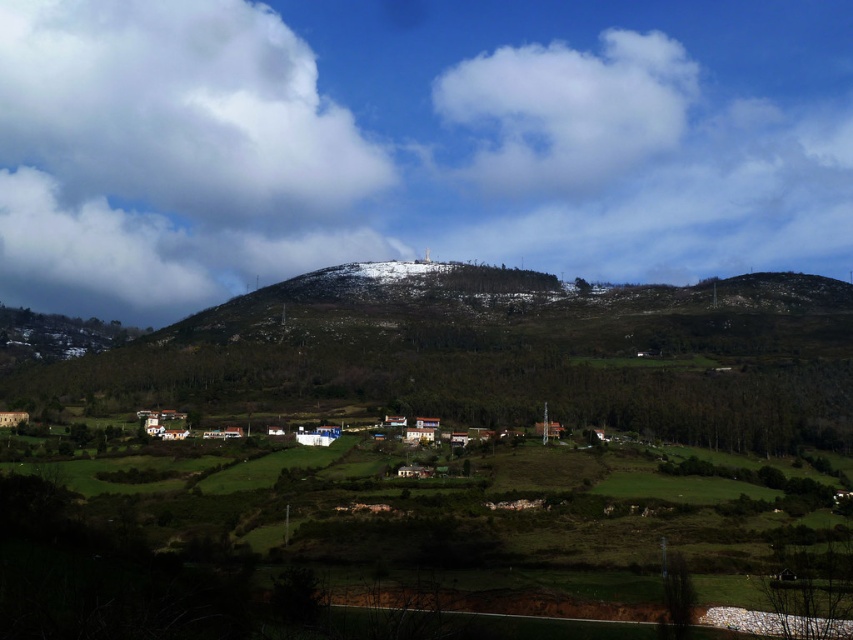
Is white fluffy cloud at upper left to the left of white fluffy cloud at upper center from the viewer's perspective?

Yes, white fluffy cloud at upper left is to the left of white fluffy cloud at upper center.

Describe the element at coordinates (178, 112) in the screenshot. Image resolution: width=853 pixels, height=640 pixels. I see `white fluffy cloud at upper left` at that location.

This screenshot has height=640, width=853. I want to click on white fluffy cloud at upper left, so click(178, 112).

This screenshot has width=853, height=640. In order to click on white fluffy cloud at upper center in this screenshot , I will do `click(567, 109)`.

Is white fluffy cloud at upper center taller than cloudy white cloud at upper left?

Correct, white fluffy cloud at upper center is much taller as cloudy white cloud at upper left.

Image resolution: width=853 pixels, height=640 pixels. What do you see at coordinates (567, 109) in the screenshot? I see `white fluffy cloud at upper center` at bounding box center [567, 109].

Find the location of a particular element. The image size is (853, 640). white fluffy cloud at upper center is located at coordinates (567, 109).

Between white fluffy cloud at upper left and cloudy white cloud at upper left, which one has more height?

white fluffy cloud at upper left

Is white fluffy cloud at upper left positioned at the back of cloudy white cloud at upper left?

Yes.

Does point (335, 141) come behind point (131, 284)?

That is False.

Find the location of a particular element. The width and height of the screenshot is (853, 640). white fluffy cloud at upper left is located at coordinates (178, 112).